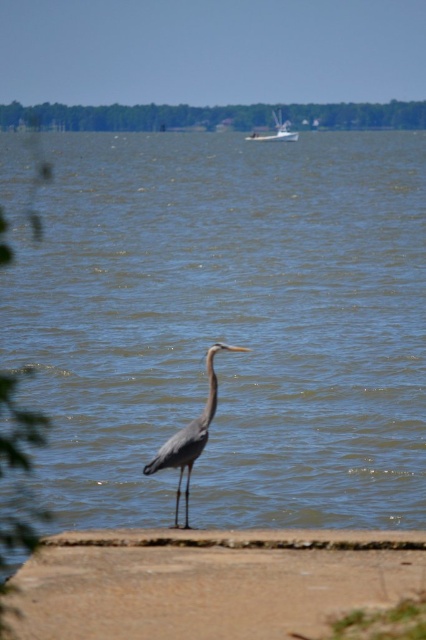
Does brown sand at lower center appear under gray matte heron at center?

Indeed, brown sand at lower center is positioned under gray matte heron at center.

Which is in front, point (203, 548) or point (150, 467)?

Positioned in front is point (203, 548).

Does point (414, 538) come behind point (187, 515)?

That is False.

At what (x,y) coordinates should I click in order to perform the action: click on brown sand at lower center. Please return your answer as a coordinate pair (x, y). The image size is (426, 640). Looking at the image, I should click on (207, 582).

Can you confirm if brown sand at lower center is smaller than white glossy boat at upper center?

Correct, brown sand at lower center occupies less space than white glossy boat at upper center.

Does brown sand at lower center appear on the right side of white glossy boat at upper center?

No, brown sand at lower center is not to the right of white glossy boat at upper center.

Locate an element on the screen. brown sand at lower center is located at coordinates (207, 582).

The width and height of the screenshot is (426, 640). What are the coordinates of `brown sand at lower center` in the screenshot? It's located at (207, 582).

Between blue water at center and brown sand at lower center, which one has more height?

blue water at center is taller.

Is the position of blue water at center more distant than that of brown sand at lower center?

Yes, it is.

This screenshot has width=426, height=640. What do you see at coordinates (224, 324) in the screenshot?
I see `blue water at center` at bounding box center [224, 324].

Where is `blue water at center`? blue water at center is located at coordinates (224, 324).